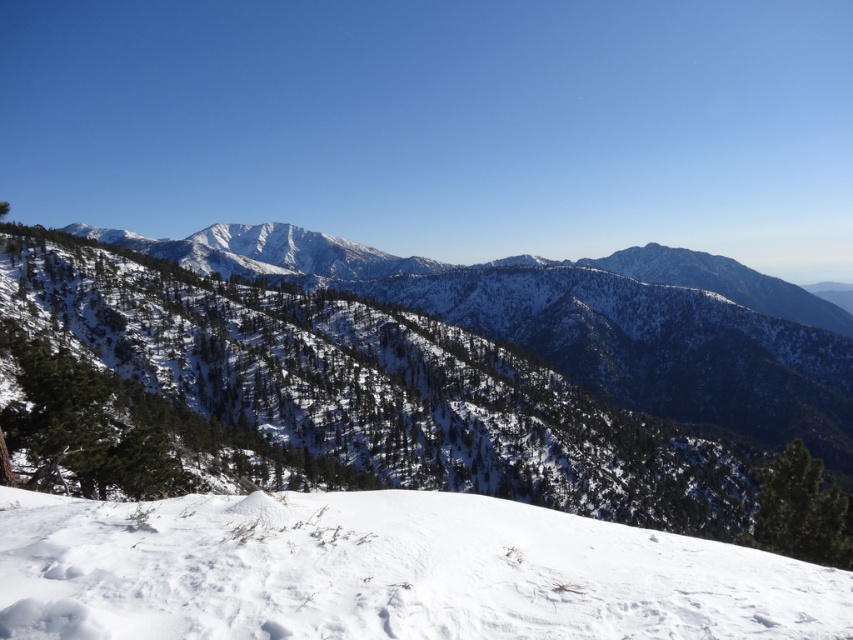
Question: Is white snow at lower center above white snow-covered mountain at center?

Choices:
 (A) no
 (B) yes

Answer: (A)

Question: Which point is farther to the camera?

Choices:
 (A) [328, 296]
 (B) [602, 602]

Answer: (A)

Question: Can you confirm if white snow at lower center is positioned to the right of white snow-covered mountain at center?

Choices:
 (A) no
 (B) yes

Answer: (A)

Question: Is white snow at lower center in front of white snow-covered mountain at center?

Choices:
 (A) no
 (B) yes

Answer: (B)

Question: Which object appears closest to the camera in this image?

Choices:
 (A) white snow-covered mountain at center
 (B) white snow at lower center

Answer: (B)

Question: Among these points, which one is farthest from the camera?

Choices:
 (A) (138, 525)
 (B) (312, 406)

Answer: (B)